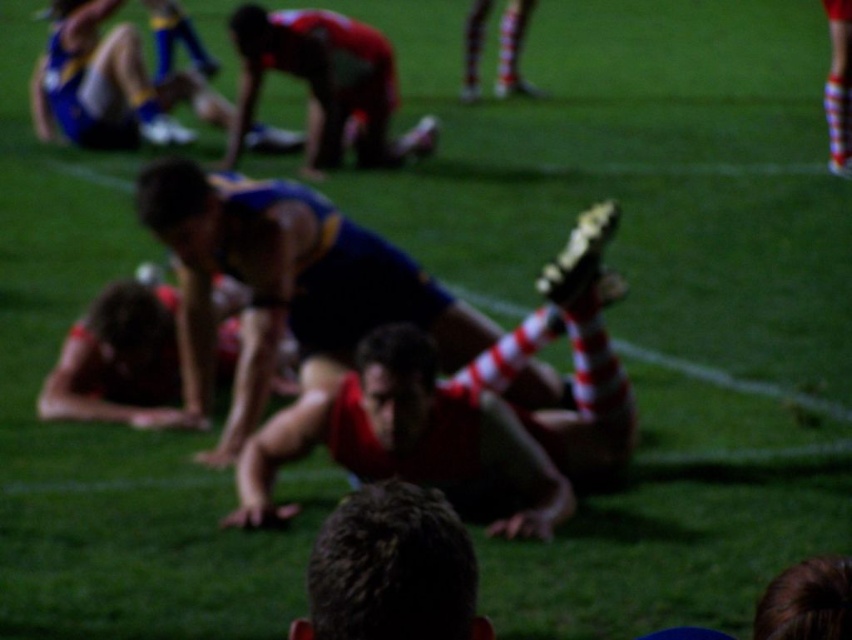
You are a photographer trying to capture a clear shot of the red and white striped sock at center and the dark brown hair at center. Which object should you focus on first if you want to ensure both are in focus?

You should focus on the red and white striped sock at center first because it is much taller than the dark brown hair at center, so adjusting focus from the taller object to the shorter one will help ensure both are in focus.

You are a photographer standing at the edge of the field. You want to take a photo of the dark brown hair at center. Where should you aim your camera to capture it?

The dark brown hair at center is located at point 0.891 on the x axis and 0.460 on the y axis, so you should aim your camera at those coordinates to capture it.

From the picture: You are a photographer trying to capture a clear shot of the dark brown hair at center and the red fabric man at upper center. Since you want both subjects to be fully visible, which subject should you focus on to ensure the shorter one isn know the answer?

The dark brown hair at center is shorter than the red fabric man at upper center. To ensure both are fully visible, focus on the red fabric man at upper center, as the shorter subject will naturally be in frame if the taller one is included.